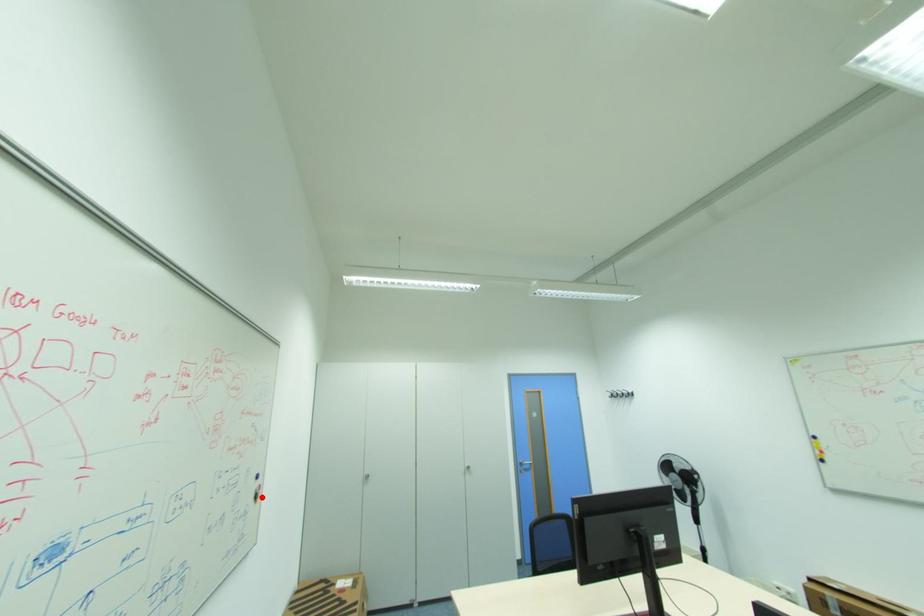
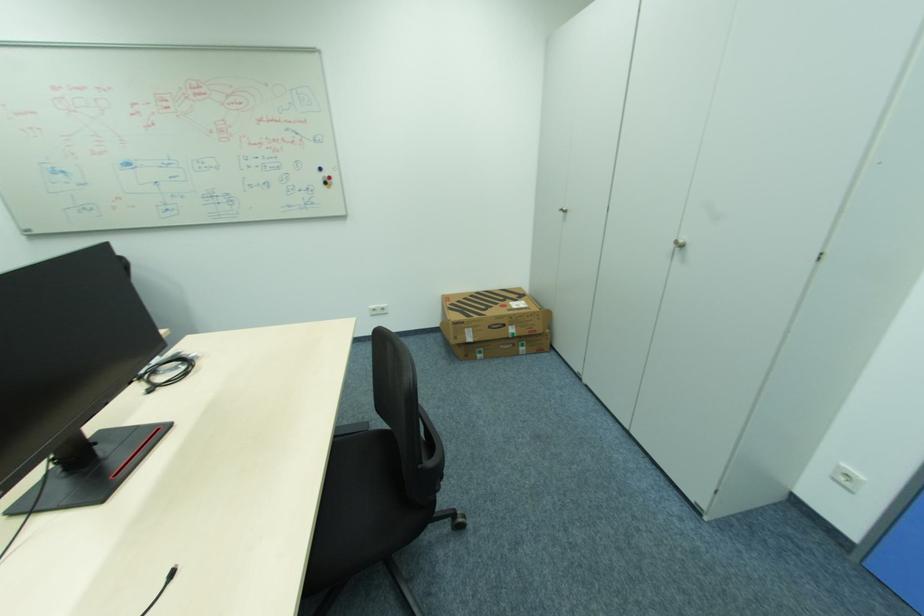
Find the pixel in the second image that matches the highlighted location in the first image.

(331, 184)